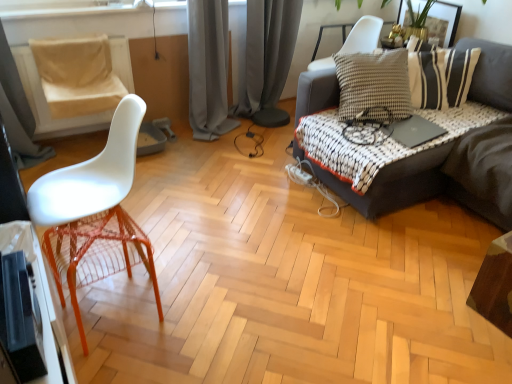
The width and height of the screenshot is (512, 384). Identify the location of vacant space in between white plastic chair at left and wooden table at lower right. (306, 284).